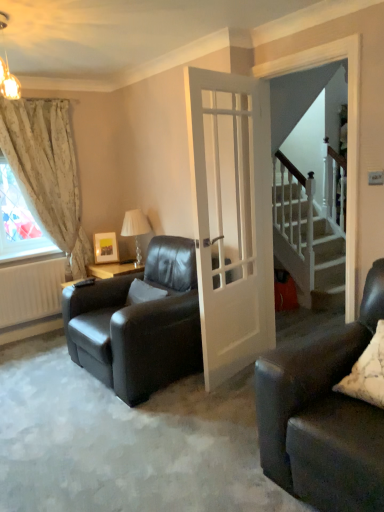
Question: Is there a large distance between floral fabric curtain at left and white matte radiator at lower left?

Choices:
 (A) no
 (B) yes

Answer: (A)

Question: Is floral fabric curtain at left outside white matte radiator at lower left?

Choices:
 (A) yes
 (B) no

Answer: (A)

Question: Is white matte radiator at lower left inside floral fabric curtain at left?

Choices:
 (A) yes
 (B) no

Answer: (A)

Question: From the image's perspective, is floral fabric curtain at left located above white matte radiator at lower left?

Choices:
 (A) yes
 (B) no

Answer: (A)

Question: Considering the relative sizes of floral fabric curtain at left and white matte radiator at lower left in the image provided, is floral fabric curtain at left wider than white matte radiator at lower left?

Choices:
 (A) yes
 (B) no

Answer: (A)

Question: Is matte gold chandelier at upper left wider or thinner than matte wooden picture frame at upper left?

Choices:
 (A) thin
 (B) wide

Answer: (B)

Question: From a real-world perspective, is matte gold chandelier at upper left positioned above or below matte wooden picture frame at upper left?

Choices:
 (A) above
 (B) below

Answer: (A)

Question: In the image, is matte gold chandelier at upper left positioned in front of or behind matte wooden picture frame at upper left?

Choices:
 (A) behind
 (B) front

Answer: (B)

Question: In terms of height, does matte gold chandelier at upper left look taller or shorter compared to matte wooden picture frame at upper left?

Choices:
 (A) short
 (B) tall

Answer: (B)

Question: Considering the positions of white glossy door at center and matte wooden picture frame at upper left in the image, is white glossy door at center wider or thinner than matte wooden picture frame at upper left?

Choices:
 (A) wide
 (B) thin

Answer: (B)

Question: From the image's perspective, is white glossy door at center above or below matte wooden picture frame at upper left?

Choices:
 (A) below
 (B) above

Answer: (B)

Question: From their relative heights in the image, would you say white glossy door at center is taller or shorter than matte wooden picture frame at upper left?

Choices:
 (A) short
 (B) tall

Answer: (B)

Question: Considering the positions of point (253, 219) and point (112, 241), is point (253, 219) closer or farther from the camera than point (112, 241)?

Choices:
 (A) closer
 (B) farther

Answer: (A)

Question: From the image's perspective, is floral fabric curtain at left located above or below white textured pillow at lower right, the second pillow positioned from the left?

Choices:
 (A) above
 (B) below

Answer: (A)

Question: Based on their positions, is floral fabric curtain at left located to the left or right of white textured pillow at lower right, the 1th pillow viewed from the front?

Choices:
 (A) left
 (B) right

Answer: (A)